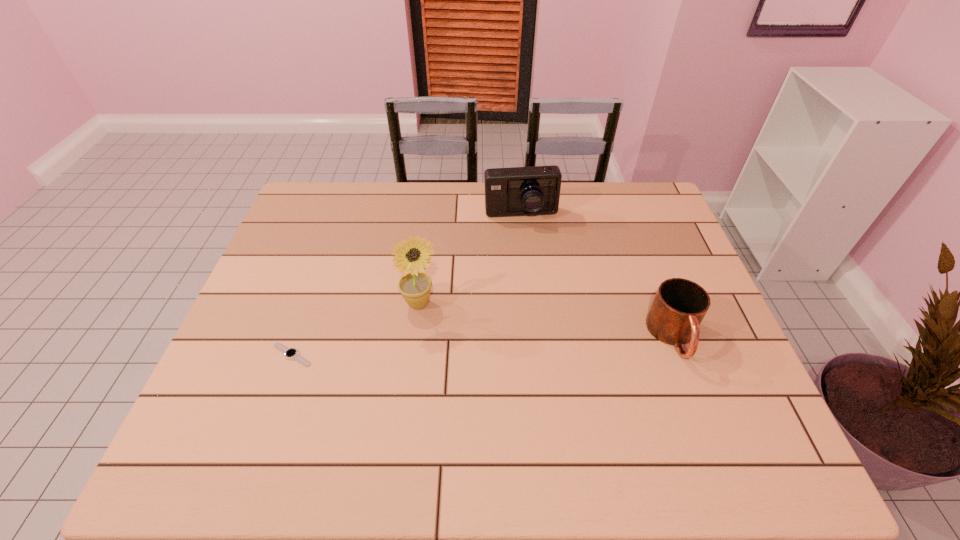
At what (x,y) coordinates should I click in order to perform the action: click on free space at the near edge of the desktop. Please return your answer as a coordinate pair (x, y). The height and width of the screenshot is (540, 960). Looking at the image, I should click on (437, 393).

The height and width of the screenshot is (540, 960). Identify the location of vacant position at the left edge of the desktop. (268, 309).

What are the coordinates of `free location at the right edge of the desktop` in the screenshot? It's located at (679, 378).

This screenshot has height=540, width=960. In the image, there is a desktop. In order to click on vacant space at the far left corner in this screenshot , I will do point(317,211).

Where is `vacant space at the near left corner of the desktop`? Image resolution: width=960 pixels, height=540 pixels. vacant space at the near left corner of the desktop is located at coordinates (244, 384).

Where is `blank space at the far right corner of the desktop`? This screenshot has width=960, height=540. blank space at the far right corner of the desktop is located at coordinates (623, 184).

I want to click on empty space between the rightmost object and the camera, so click(x=597, y=276).

Where is `free area in between the third shortest object and the sunflower`? The width and height of the screenshot is (960, 540). free area in between the third shortest object and the sunflower is located at coordinates (470, 259).

Where is `free spot between the second object from left to right and the second shortest object`? free spot between the second object from left to right and the second shortest object is located at coordinates (547, 320).

Where is `vacant region between the shortest object and the third tallest object`? vacant region between the shortest object and the third tallest object is located at coordinates (483, 346).